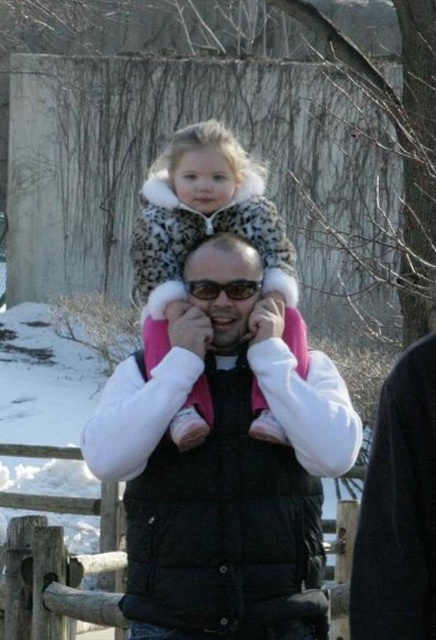
Question: Which of the following is the farthest from the observer?

Choices:
 (A) black puffy vest at center
 (B) spotted fur coat at center

Answer: (B)

Question: Which point is farther from the camera taking this photo?

Choices:
 (A) (310, 624)
 (B) (180, 205)

Answer: (B)

Question: Observing the image, what is the correct spatial positioning of black puffy vest at center in reference to spotted fur coat at center?

Choices:
 (A) left
 (B) right

Answer: (B)

Question: Does black puffy vest at center appear on the left side of spotted fur coat at center?

Choices:
 (A) yes
 (B) no

Answer: (B)

Question: Can you confirm if black puffy vest at center is bigger than spotted fur coat at center?

Choices:
 (A) no
 (B) yes

Answer: (A)

Question: Which of the following is the farthest from the observer?

Choices:
 (A) (235, 484)
 (B) (155, 234)

Answer: (B)